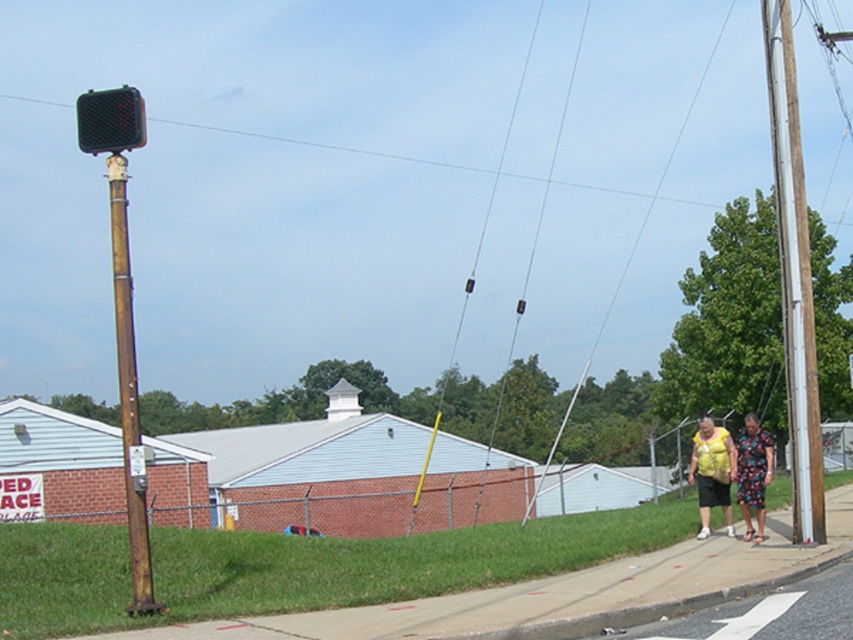
Question: Which point appears farthest from the camera in this image?

Choices:
 (A) (743, 467)
 (B) (793, 397)
 (C) (142, 556)

Answer: (A)

Question: Is white painted wood pole at right wider than yellow fabric dress at lower right?

Choices:
 (A) no
 (B) yes

Answer: (A)

Question: Which object appears closest to the camera in this image?

Choices:
 (A) rusty metal pole at left
 (B) yellow fabric dress at lower right

Answer: (A)

Question: Does rusty metal pole at left appear on the right side of yellow fabric dress at lower right?

Choices:
 (A) no
 (B) yes

Answer: (A)

Question: Does white painted wood pole at right have a greater width compared to yellow fabric dress at lower right?

Choices:
 (A) no
 (B) yes

Answer: (A)

Question: Among these objects, which one is nearest to the camera?

Choices:
 (A) yellow fabric dress at lower right
 (B) rusty metal pole at left

Answer: (B)